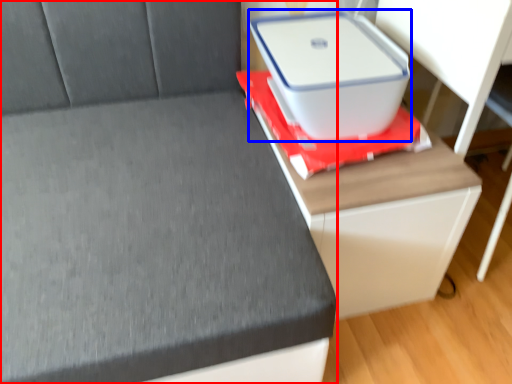
Question: Which point is closer to the camera, furniture (highlighted by a red box) or storage box (highlighted by a blue box)?

Choices:
 (A) furniture
 (B) storage box

Answer: (A)